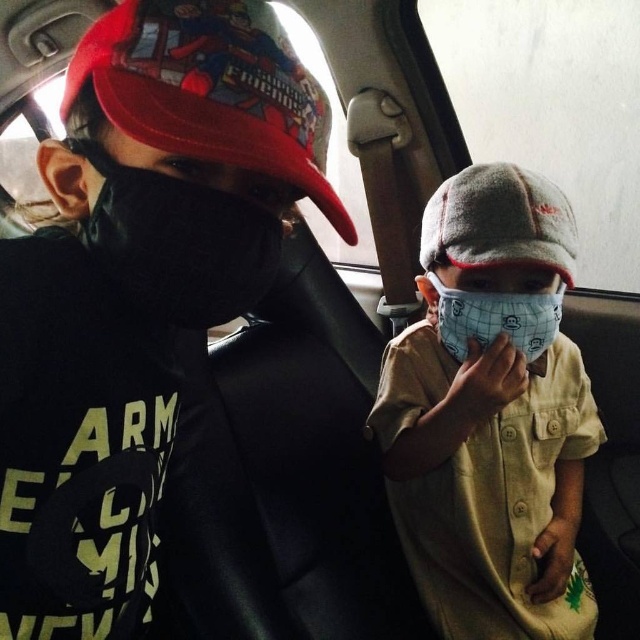
Question: Is white fabric mask at center positioned at the back of white mesh mask at center?

Choices:
 (A) no
 (B) yes

Answer: (A)

Question: Which object is closer to the camera taking this photo?

Choices:
 (A) white fabric mask at center
 (B) white mesh mask at center
 (C) black matte mask at left

Answer: (C)

Question: Considering the relative positions of white fabric mask at center and white mesh mask at center in the image provided, where is white fabric mask at center located with respect to white mesh mask at center?

Choices:
 (A) below
 (B) above

Answer: (A)

Question: Which of the following is the closest to the observer?

Choices:
 (A) (454, 461)
 (B) (260, 275)
 (C) (458, 314)

Answer: (B)

Question: Which point is closer to the camera taking this photo?

Choices:
 (A) (122, 227)
 (B) (586, 628)

Answer: (A)

Question: Does white fabric mask at center appear on the left side of black matte mask at left?

Choices:
 (A) no
 (B) yes

Answer: (A)